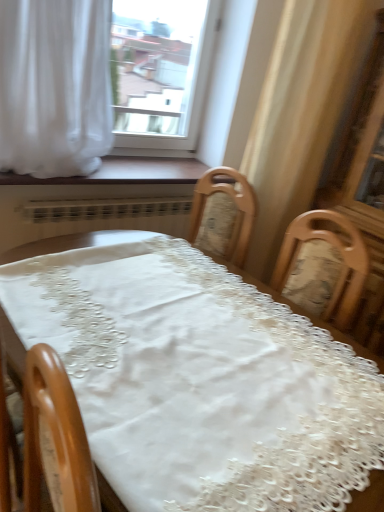
Question: Is white sheer curtain at upper left wider than wooden at lower center?

Choices:
 (A) no
 (B) yes

Answer: (B)

Question: Considering the relative positions of white sheer curtain at upper left and wooden at lower center in the image provided, is white sheer curtain at upper left to the left of wooden at lower center from the viewer's perspective?

Choices:
 (A) yes
 (B) no

Answer: (A)

Question: Is wooden at lower center at the back of white sheer curtain at upper left?

Choices:
 (A) no
 (B) yes

Answer: (A)

Question: Does white sheer curtain at upper left come in front of wooden at lower center?

Choices:
 (A) no
 (B) yes

Answer: (B)

Question: Is white sheer curtain at upper left positioned far away from wooden at lower center?

Choices:
 (A) yes
 (B) no

Answer: (B)

Question: Is white sheer curtain at upper left positioned beyond the bounds of wooden at lower center?

Choices:
 (A) no
 (B) yes

Answer: (B)

Question: Considering the relative sizes of white lace tablecloth at center and white sheer curtain at upper left in the image provided, is white lace tablecloth at center wider than white sheer curtain at upper left?

Choices:
 (A) yes
 (B) no

Answer: (A)

Question: Is white lace tablecloth at center bigger than white sheer curtain at upper left?

Choices:
 (A) yes
 (B) no

Answer: (A)

Question: Is white lace tablecloth at center smaller than white sheer curtain at upper left?

Choices:
 (A) no
 (B) yes

Answer: (A)

Question: Can you confirm if white lace tablecloth at center is taller than white sheer curtain at upper left?

Choices:
 (A) yes
 (B) no

Answer: (A)

Question: From the image's perspective, is white lace tablecloth at center under white sheer curtain at upper left?

Choices:
 (A) no
 (B) yes

Answer: (B)

Question: From the image's perspective, is white lace tablecloth at center above white sheer curtain at upper left?

Choices:
 (A) yes
 (B) no

Answer: (B)

Question: Does transparent glass window at upper center have a greater height compared to white sheer curtain at upper left?

Choices:
 (A) yes
 (B) no

Answer: (A)